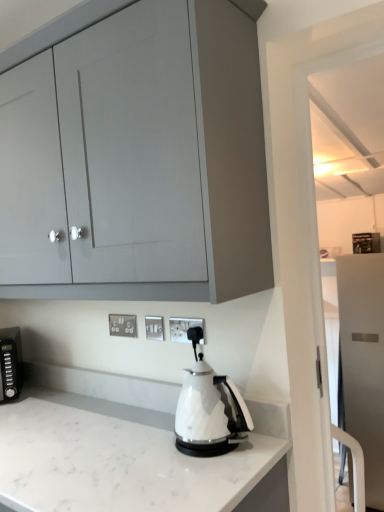
Question: Can you confirm if white plastic electric outlet at center, the second electric outlet viewed from the front, is taller than satin white refrigerator at right, placed as the 1th cabinetry when sorted from right to left?

Choices:
 (A) yes
 (B) no

Answer: (B)

Question: Can you confirm if white plastic electric outlet at center, placed as the 2th electric outlet when sorted from right to left, is wider than satin white refrigerator at right, which is the 1th cabinetry in back-to-front order?

Choices:
 (A) yes
 (B) no

Answer: (B)

Question: Is white plastic electric outlet at center, placed as the 2th electric outlet when sorted from right to left, positioned beyond the bounds of satin white refrigerator at right, placed as the second cabinetry when sorted from left to right?

Choices:
 (A) no
 (B) yes

Answer: (B)

Question: From a real-world perspective, is white plastic electric outlet at center, placed as the second electric outlet when sorted from back to front, positioned over satin white refrigerator at right, arranged as the 1th cabinetry when ordered from the bottom, based on gravity?

Choices:
 (A) no
 (B) yes

Answer: (B)

Question: Does white plastic electric outlet at center, placed as the 2th electric outlet when sorted from right to left, lie behind satin white refrigerator at right, the second cabinetry viewed from the top?

Choices:
 (A) no
 (B) yes

Answer: (A)

Question: Is white plastic electric outlet at center, the second electric outlet viewed from the front, surrounding satin white refrigerator at right, the second cabinetry viewed from the top?

Choices:
 (A) no
 (B) yes

Answer: (A)

Question: Is matte gray cabinet at upper left, the 2th cabinetry when ordered from back to front, facing towards silver metallic electrical outlet at center, the third electric outlet in the right-to-left sequence?

Choices:
 (A) no
 (B) yes

Answer: (A)

Question: Is matte gray cabinet at upper left, the 2th cabinetry when ordered from bottom to top, far away from silver metallic electrical outlet at center, which appears as the 1th electric outlet when viewed from the left?

Choices:
 (A) yes
 (B) no

Answer: (B)

Question: Can you confirm if matte gray cabinet at upper left, the 1th cabinetry when ordered from left to right, is positioned to the left of silver metallic electrical outlet at center, the third electric outlet from the front?

Choices:
 (A) yes
 (B) no

Answer: (A)

Question: Considering the relative sizes of matte gray cabinet at upper left, the 2th cabinetry when ordered from back to front, and silver metallic electrical outlet at center, the third electric outlet in the right-to-left sequence, in the image provided, is matte gray cabinet at upper left, the 2th cabinetry when ordered from back to front, bigger than silver metallic electrical outlet at center, the third electric outlet in the right-to-left sequence,?

Choices:
 (A) no
 (B) yes

Answer: (B)

Question: From a real-world perspective, is matte gray cabinet at upper left, the 2th cabinetry when ordered from back to front, over silver metallic electrical outlet at center, the third electric outlet in the right-to-left sequence?

Choices:
 (A) yes
 (B) no

Answer: (A)

Question: From a real-world perspective, is matte gray cabinet at upper left, arranged as the first cabinetry when viewed from the top, physically below silver metallic electrical outlet at center, the third electric outlet in the right-to-left sequence?

Choices:
 (A) yes
 (B) no

Answer: (B)

Question: Is white plastic electric outlet at center, placed as the second electric outlet when sorted from back to front, looking in the opposite direction of white plastic electric outlet at center, the third electric outlet viewed from the left?

Choices:
 (A) yes
 (B) no

Answer: (B)